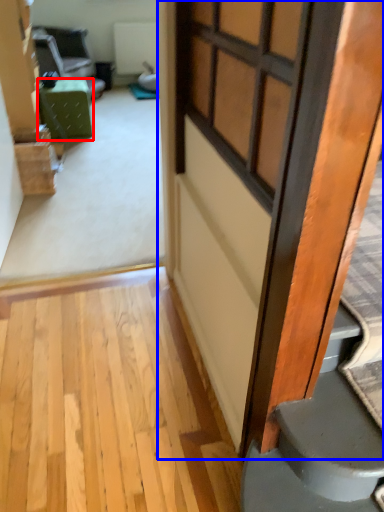
Question: Which point is further to the camera, furniture (highlighted by a red box) or door (highlighted by a blue box)?

Choices:
 (A) furniture
 (B) door

Answer: (A)